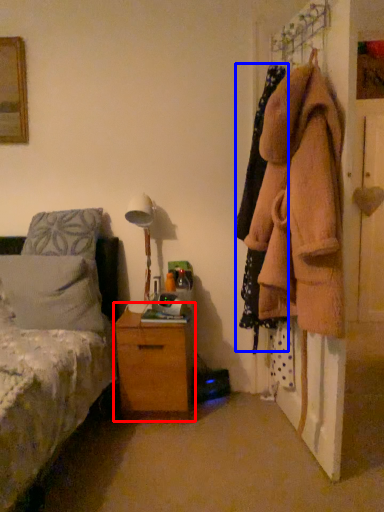
Question: Which object is further to the camera taking this photo, chest of drawers (highlighted by a red box) or clothing (highlighted by a blue box)?

Choices:
 (A) chest of drawers
 (B) clothing

Answer: (A)